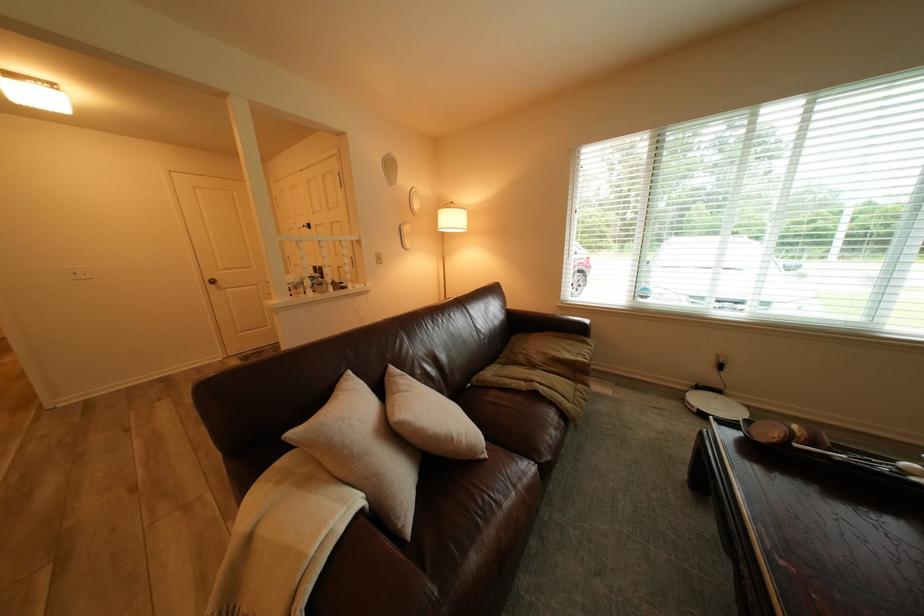
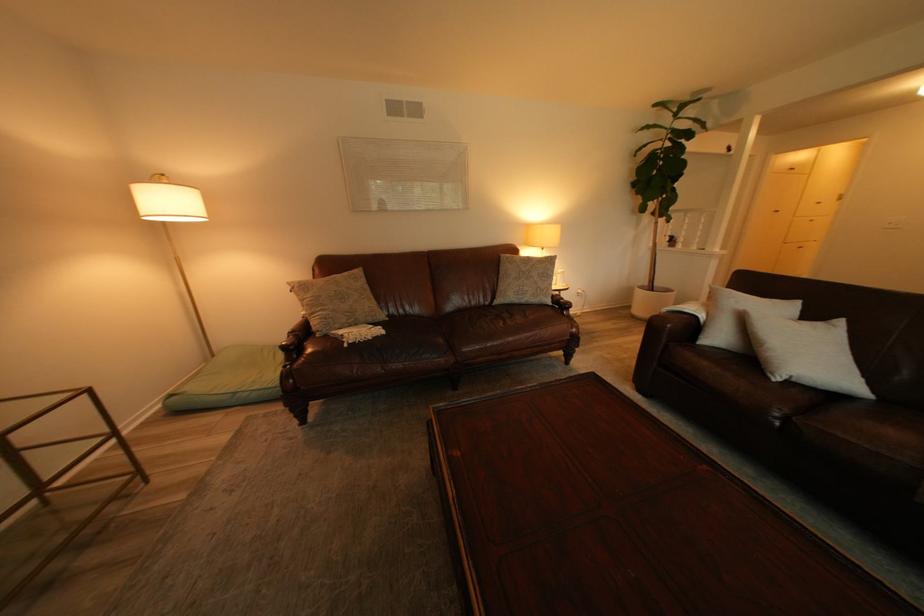
Find the pixel in the second image that matches point (499, 461) in the first image.

(784, 379)